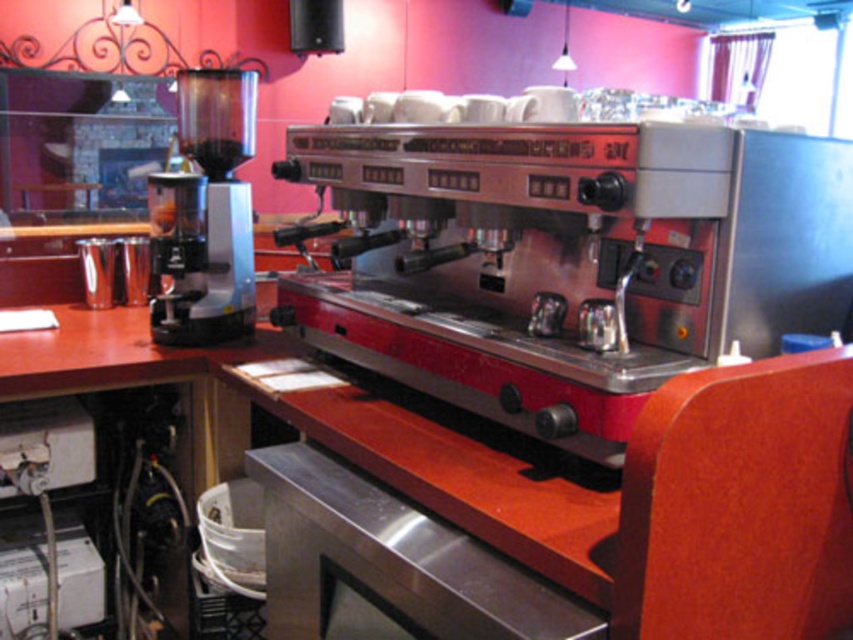
Question: Is metallic espresso machine at center closer to camera compared to matte black coffee grinder at left?

Choices:
 (A) yes
 (B) no

Answer: (A)

Question: Is metallic espresso machine at center closer to the viewer compared to matte black coffee grinder at left?

Choices:
 (A) yes
 (B) no

Answer: (A)

Question: Among these objects, which one is farthest from the camera?

Choices:
 (A) metallic espresso machine at center
 (B) matte black coffee grinder at left

Answer: (B)

Question: Can you confirm if metallic espresso machine at center is positioned to the right of matte black coffee grinder at left?

Choices:
 (A) no
 (B) yes

Answer: (B)

Question: Which point is closer to the camera?

Choices:
 (A) metallic espresso machine at center
 (B) matte black coffee grinder at left

Answer: (A)